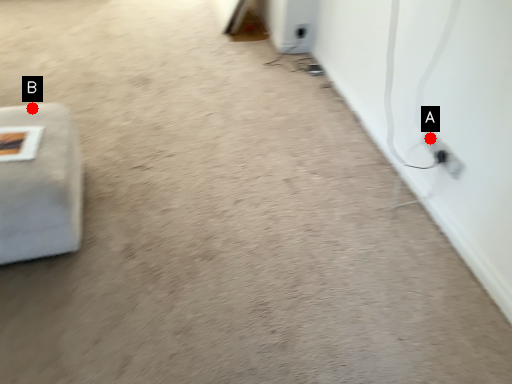
Question: Two points are circled on the image, labeled by A and B beside each circle. Which point appears farthest from the camera in this image?

Choices:
 (A) A is further
 (B) B is further

Answer: (A)